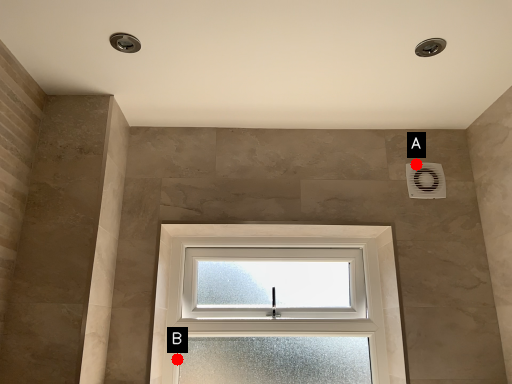
Question: Two points are circled on the image, labeled by A and B beside each circle. Which point is farther to the camera?

Choices:
 (A) A is further
 (B) B is further

Answer: (A)